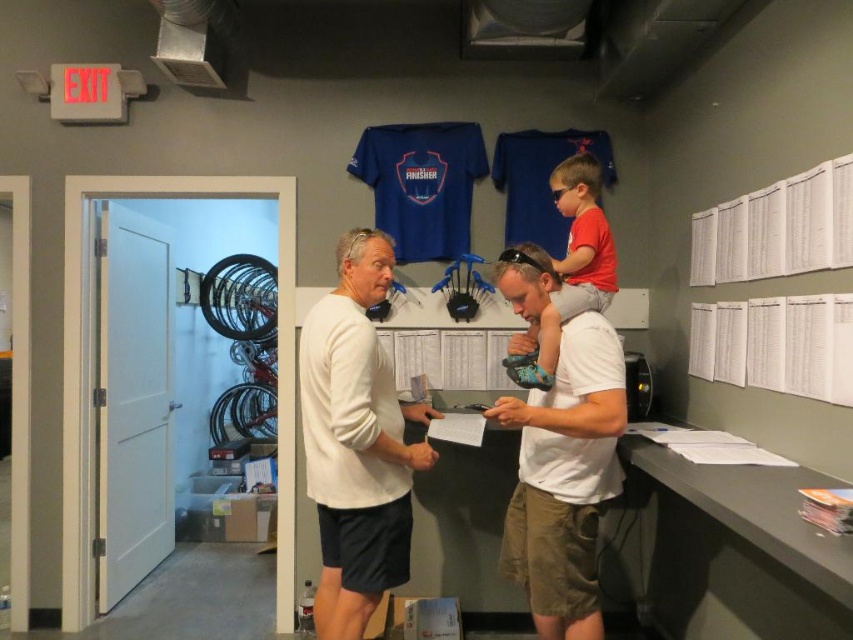
Between white cotton shirt at center and matte red shirt at upper center, which one has more height?

white cotton shirt at center is taller.

Does white cotton shirt at center come behind matte red shirt at upper center?

No.

You are a GUI agent. You are given a task and a screenshot of the screen. Output one action in this format:
    pyautogui.click(x=<x>, y=<y>)
    Task: Click on the white cotton shirt at center
    Image resolution: width=853 pixels, height=640 pixels.
    Given the screenshot: What is the action you would take?
    pyautogui.click(x=566, y=477)

I want to click on white cotton shirt at center, so click(566, 477).

Is white matte long-sleeve shirt at center thinner than white cotton shirt at center?

Correct, white matte long-sleeve shirt at center's width is less than white cotton shirt at center's.

Which of these two, white matte long-sleeve shirt at center or white cotton shirt at center, stands shorter?

white cotton shirt at center

Measure the distance between white matte long-sleeve shirt at center and camera.

white matte long-sleeve shirt at center and camera are 2.04 meters apart from each other.

Where is `white matte long-sleeve shirt at center`? Image resolution: width=853 pixels, height=640 pixels. white matte long-sleeve shirt at center is located at coordinates (357, 442).

Who is more forward, (410, 413) or (567, 241)?

Point (410, 413)

Locate an element on the screen. This screenshot has width=853, height=640. white matte long-sleeve shirt at center is located at coordinates (357, 442).

I want to click on white matte long-sleeve shirt at center, so click(357, 442).